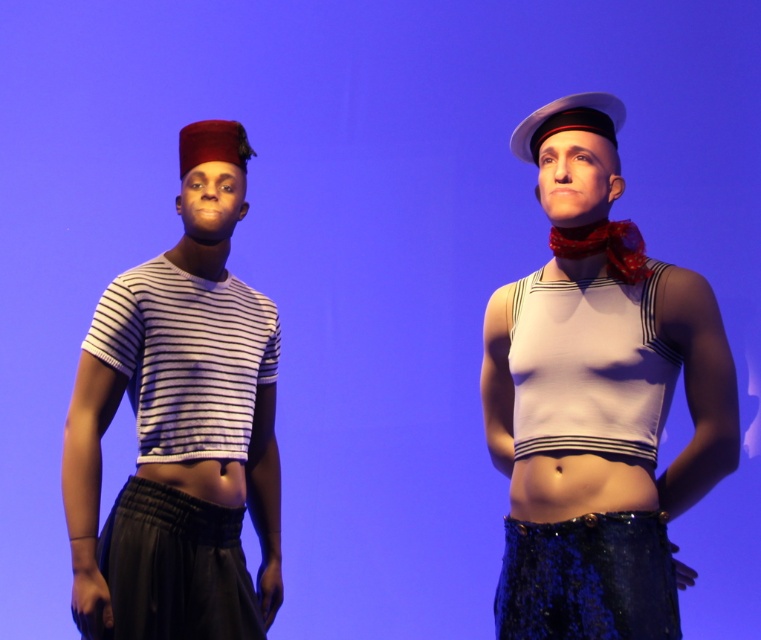
Question: Which object is positioned closest to the white matte sailor top at center?

Choices:
 (A) matte striped shirt at left
 (B) white striped fabric shirt at left

Answer: (B)

Question: Is matte striped shirt at left bigger than white striped fabric shirt at left?

Choices:
 (A) yes
 (B) no

Answer: (A)

Question: Which of these objects is positioned farthest from the matte striped shirt at left?

Choices:
 (A) white striped fabric shirt at left
 (B) white matte sailor top at center

Answer: (B)

Question: Is white matte sailor top at center to the right of matte striped shirt at left from the viewer's perspective?

Choices:
 (A) yes
 (B) no

Answer: (A)

Question: Which point is farther to the camera?

Choices:
 (A) (699, 320)
 (B) (279, 509)

Answer: (B)

Question: Does white matte sailor top at center appear under matte striped shirt at left?

Choices:
 (A) no
 (B) yes

Answer: (A)